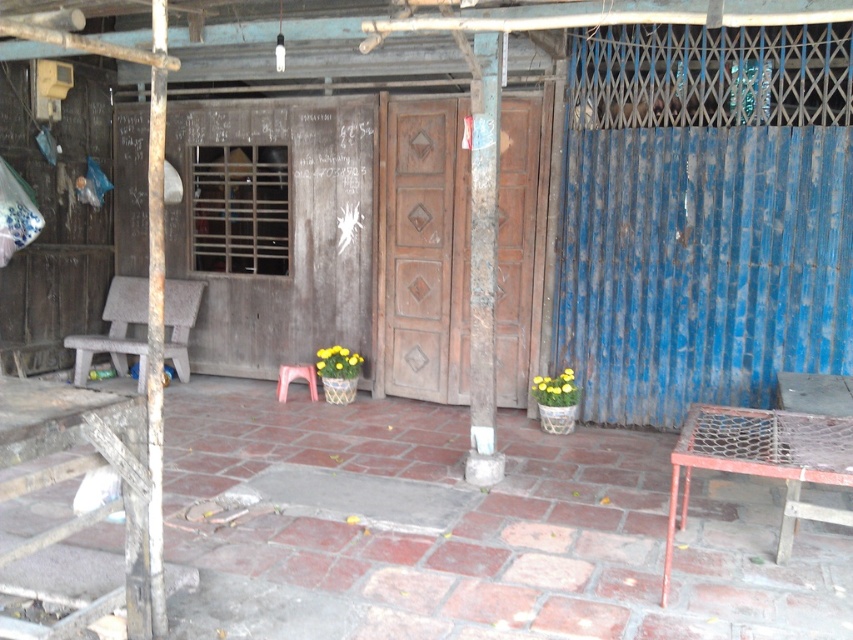
Find the location of a particular element. This screenshot has height=640, width=853. wooden door at center is located at coordinates (426, 250).

You are a GUI agent. You are given a task and a screenshot of the screen. Output one action in this format:
    pyautogui.click(x=<x>, y=<y>)
    Task: Click on the wooden door at center
    The height and width of the screenshot is (640, 853).
    Given the screenshot: What is the action you would take?
    pyautogui.click(x=426, y=250)